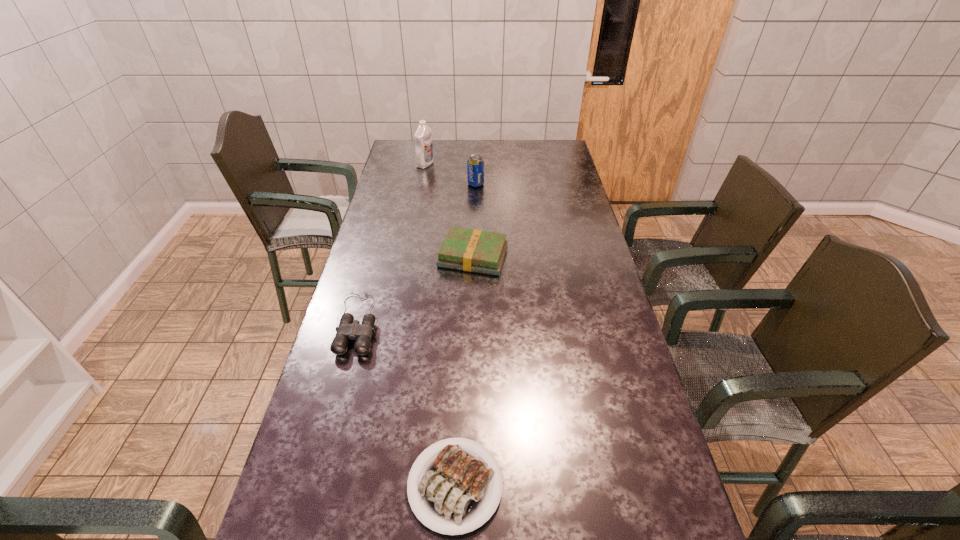
This screenshot has height=540, width=960. Identify the location of the farthest object. (424, 156).

Where is `the tallest object`? the tallest object is located at coordinates (424, 156).

This screenshot has width=960, height=540. Identify the location of soda. (475, 165).

Where is `the second farthest object`? Image resolution: width=960 pixels, height=540 pixels. the second farthest object is located at coordinates click(x=475, y=165).

Locate an element on the screen. The image size is (960, 540). book is located at coordinates (471, 250).

Find the location of a particular element. The width and height of the screenshot is (960, 540). the third nearest object is located at coordinates (471, 250).

At what (x,y) coordinates should I click in order to perform the action: click on the fourth farthest object. Please return your answer as a coordinate pair (x, y). The width and height of the screenshot is (960, 540). Looking at the image, I should click on (349, 329).

Locate an element on the screen. The height and width of the screenshot is (540, 960). the leftmost object is located at coordinates (349, 329).

The height and width of the screenshot is (540, 960). Identify the location of vacant region located 0.060m on the left of the detergent. (404, 164).

Identify the location of free space located on the back of the fourth nearest object. The height and width of the screenshot is (540, 960). (476, 148).